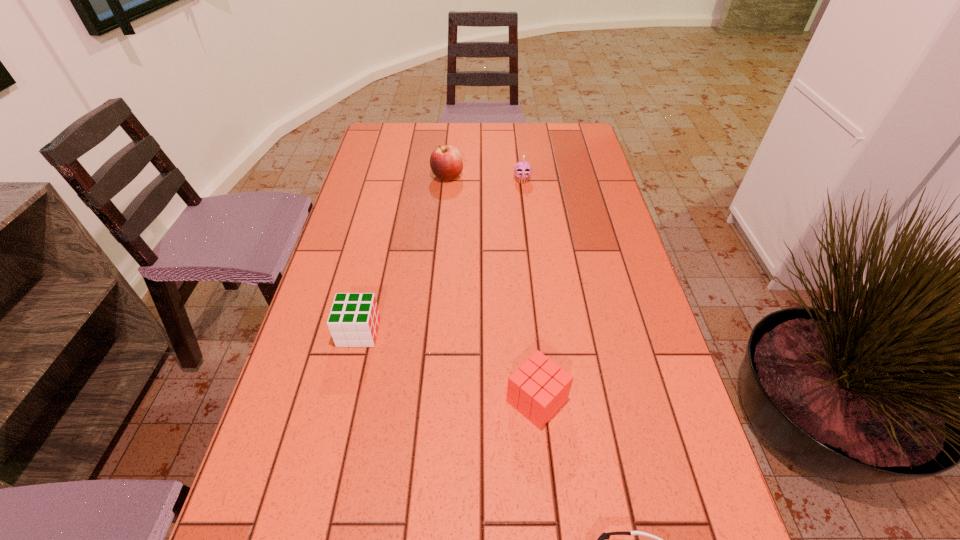
What are the coordinates of `free space that satisfies the following two spatial constraints: 1. on the red face of the nearer cube; 2. on the right side of the farther cube` in the screenshot? It's located at (343, 401).